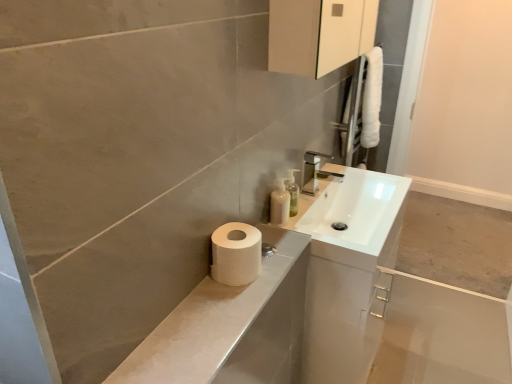
Question: Is white matte toilet paper at lower left further to the viewer compared to translucent plastic soap dispenser at upper right?

Choices:
 (A) no
 (B) yes

Answer: (A)

Question: Can translucent plastic soap dispenser at upper right be found inside white matte toilet paper at lower left?

Choices:
 (A) no
 (B) yes

Answer: (A)

Question: From the image's perspective, is white matte toilet paper at lower left on translucent plastic soap dispenser at upper right?

Choices:
 (A) yes
 (B) no

Answer: (B)

Question: From a real-world perspective, is white matte toilet paper at lower left below translucent plastic soap dispenser at upper right?

Choices:
 (A) no
 (B) yes

Answer: (A)

Question: Is white matte toilet paper at lower left oriented away from translucent plastic soap dispenser at upper right?

Choices:
 (A) no
 (B) yes

Answer: (A)

Question: Is white matte toilet paper at lower left shorter than translucent plastic soap dispenser at upper right?

Choices:
 (A) no
 (B) yes

Answer: (B)

Question: Could you tell me if translucent plastic soap dispenser at upper right is facing translucent plastic soap dispenser at upper center?

Choices:
 (A) yes
 (B) no

Answer: (B)

Question: From a real-world perspective, is translucent plastic soap dispenser at upper right under translucent plastic soap dispenser at upper center?

Choices:
 (A) no
 (B) yes

Answer: (B)

Question: Does translucent plastic soap dispenser at upper right appear on the left side of translucent plastic soap dispenser at upper center?

Choices:
 (A) yes
 (B) no

Answer: (A)

Question: From the image's perspective, does translucent plastic soap dispenser at upper right appear higher than translucent plastic soap dispenser at upper center?

Choices:
 (A) yes
 (B) no

Answer: (B)

Question: Is translucent plastic soap dispenser at upper right outside translucent plastic soap dispenser at upper center?

Choices:
 (A) yes
 (B) no

Answer: (A)

Question: Can you confirm if translucent plastic soap dispenser at upper right is bigger than translucent plastic soap dispenser at upper center?

Choices:
 (A) yes
 (B) no

Answer: (A)

Question: From a real-world perspective, is white matte toilet paper at lower left physically above translucent plastic soap dispenser at upper center?

Choices:
 (A) no
 (B) yes

Answer: (A)